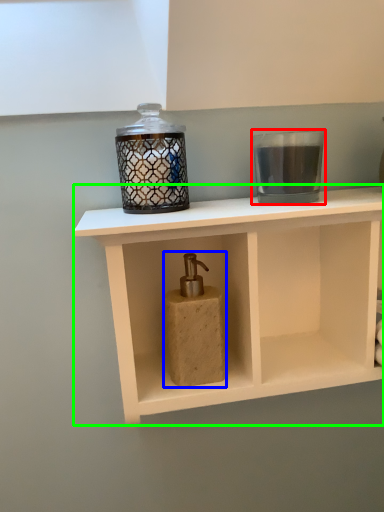
Question: Which object is the farthest from candle holder (highlighted by a red box)? Choose among these: soap dispenser (highlighted by a blue box) or shelf (highlighted by a green box).

Choices:
 (A) soap dispenser
 (B) shelf

Answer: (A)